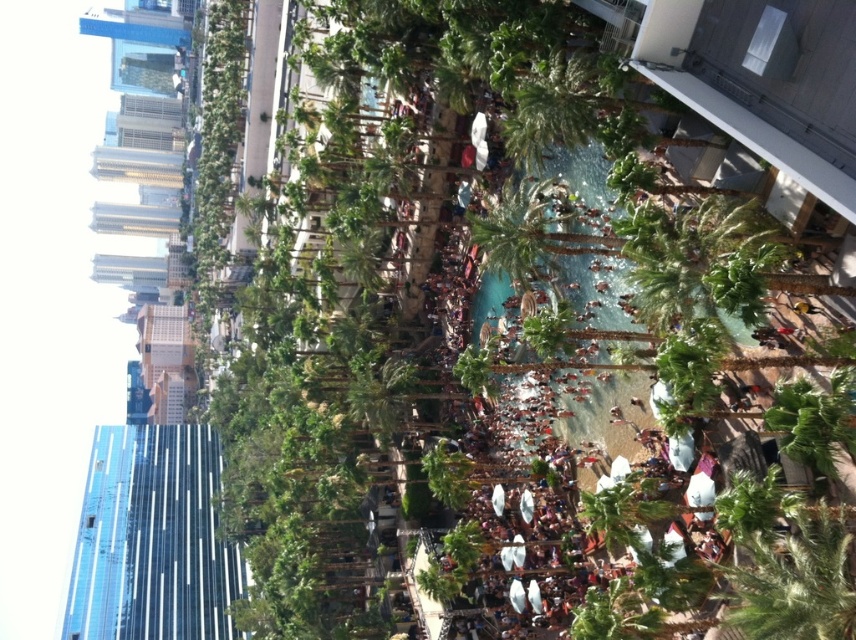
Does transparent glass building at left appear over green leafy palm tree at center?

Incorrect, transparent glass building at left is not positioned above green leafy palm tree at center.

From the picture: Can you confirm if transparent glass building at left is wider than green leafy palm tree at center?

Yes, transparent glass building at left is wider than green leafy palm tree at center.

Where is `transparent glass building at left`? Image resolution: width=856 pixels, height=640 pixels. transparent glass building at left is located at coordinates (152, 540).